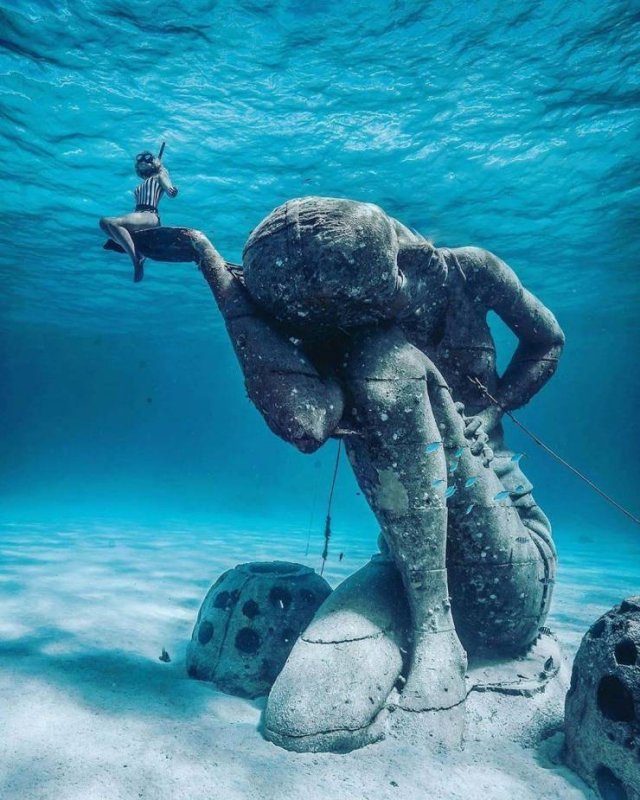
This screenshot has width=640, height=800. I want to click on statue head tilted, so click(347, 278).